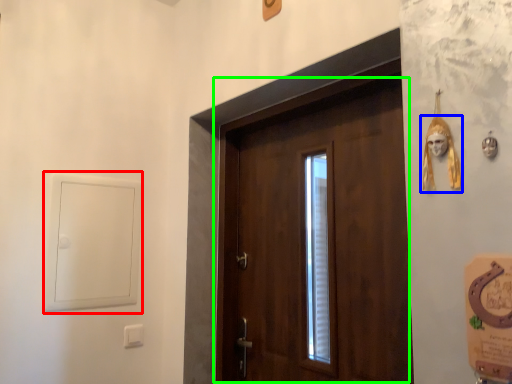
Question: Which object is positioned closest to window (highlighted by a red box)? Select from skull (highlighted by a blue box) and door (highlighted by a green box).

Choices:
 (A) skull
 (B) door

Answer: (B)